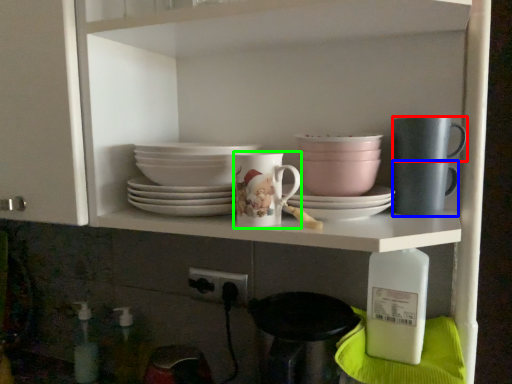
Question: Estimate the real-world distances between objects in this image. Which object is farther from tableware (highlighted by a red box), mug (highlighted by a blue box) or coffee cup (highlighted by a green box)?

Choices:
 (A) mug
 (B) coffee cup

Answer: (B)